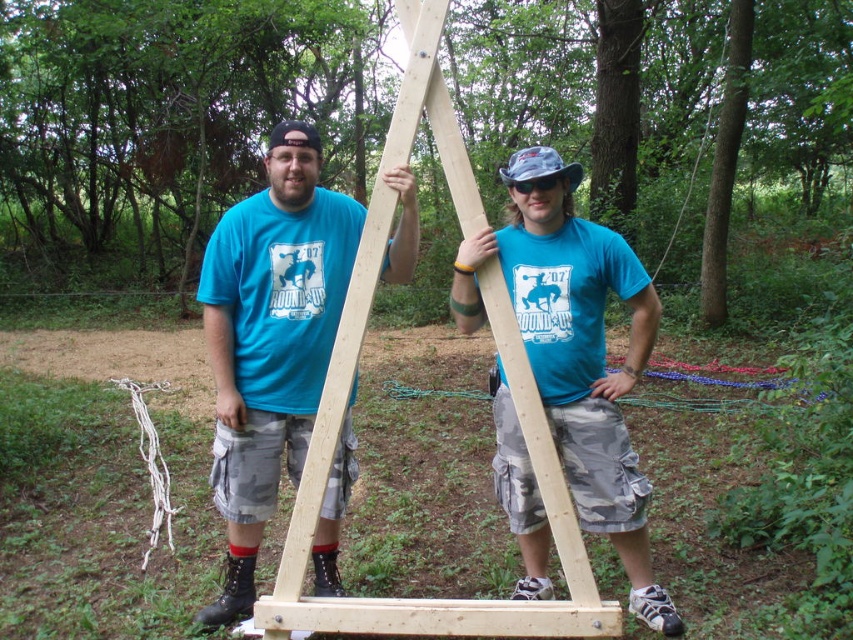
You are a contractor trying to move a 14 inch tool box from the matte wood frame at center to the natural wood ladder at center. Can you do this without the box touching either object?

The matte wood frame at center is 13.55 inches away from natural wood ladder at center. Since the tool box is 14 inches wide, it would not fit between them without touching either object.

You are planning to store both the matte wood frame at center and the natural wood ladder at center in a storage room that can only hold items taking up the space of the larger object. Which object should you store first to ensure both fit?

You should store the natural wood ladder at center first since it takes up more space than the matte wood frame at center, allowing both to fit within the storage room capacity.